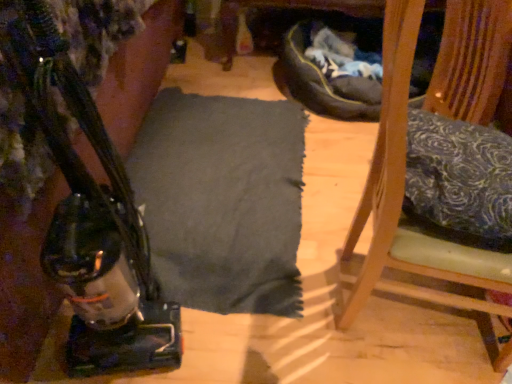
Question: Is matte black vacuum cleaner at left thinner than blue floral fabric pillow at right?

Choices:
 (A) yes
 (B) no

Answer: (A)

Question: Is matte black vacuum cleaner at left outside blue floral fabric pillow at right?

Choices:
 (A) no
 (B) yes

Answer: (B)

Question: From a real-world perspective, is matte black vacuum cleaner at left below blue floral fabric pillow at right?

Choices:
 (A) no
 (B) yes

Answer: (B)

Question: Is the position of matte black vacuum cleaner at left less distant than that of blue floral fabric pillow at right?

Choices:
 (A) yes
 (B) no

Answer: (A)

Question: From a real-world perspective, is matte black vacuum cleaner at left positioned over blue floral fabric pillow at right based on gravity?

Choices:
 (A) yes
 (B) no

Answer: (B)

Question: From the image's perspective, is wooden chair at right located above or below matte black vacuum cleaner at left?

Choices:
 (A) below
 (B) above

Answer: (B)

Question: Is wooden chair at right situated inside matte black vacuum cleaner at left or outside?

Choices:
 (A) outside
 (B) inside

Answer: (A)

Question: Considering the positions of wooden chair at right and matte black vacuum cleaner at left in the image, is wooden chair at right taller or shorter than matte black vacuum cleaner at left?

Choices:
 (A) tall
 (B) short

Answer: (B)

Question: From a real-world perspective, is wooden chair at right physically located above or below matte black vacuum cleaner at left?

Choices:
 (A) above
 (B) below

Answer: (B)

Question: Considering the positions of blue floral fabric pillow at right and wooden chair at right in the image, is blue floral fabric pillow at right wider or thinner than wooden chair at right?

Choices:
 (A) thin
 (B) wide

Answer: (A)

Question: Considering their positions, is blue floral fabric pillow at right located in front of or behind wooden chair at right?

Choices:
 (A) behind
 (B) front

Answer: (A)

Question: From the image's perspective, is blue floral fabric pillow at right positioned above or below wooden chair at right?

Choices:
 (A) above
 (B) below

Answer: (A)

Question: Is point (433, 122) positioned closer to the camera than point (488, 269)?

Choices:
 (A) farther
 (B) closer

Answer: (A)

Question: Would you say wooden chair at right is inside or outside blue floral fabric pillow at right?

Choices:
 (A) inside
 (B) outside

Answer: (B)

Question: Looking at their shapes, would you say wooden chair at right is wider or thinner than blue floral fabric pillow at right?

Choices:
 (A) wide
 (B) thin

Answer: (A)